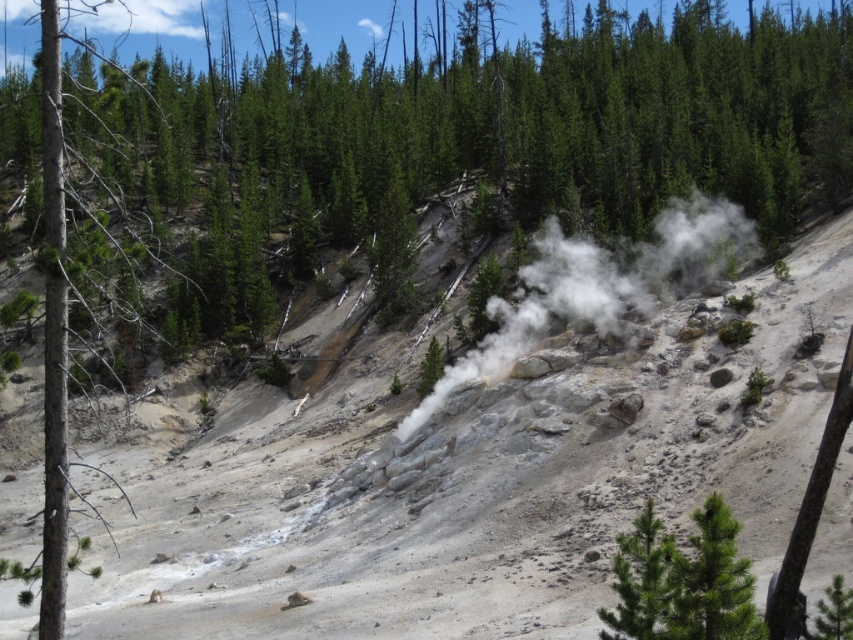
Question: Does gray rocky hillside at center lie behind white steam at center?

Choices:
 (A) yes
 (B) no

Answer: (B)

Question: Is gray rocky hillside at center closer to the viewer compared to white steam at center?

Choices:
 (A) no
 (B) yes

Answer: (B)

Question: Does gray rocky hillside at center have a greater width compared to white steam at center?

Choices:
 (A) no
 (B) yes

Answer: (B)

Question: Which of the following is the closest to the observer?

Choices:
 (A) gray rocky hillside at center
 (B) white steam at center

Answer: (A)

Question: Which of the following is the closest to the observer?

Choices:
 (A) pos(750,240)
 (B) pos(677,403)

Answer: (B)

Question: Which of the following is the farthest from the observer?

Choices:
 (A) (409, 580)
 (B) (575, 316)

Answer: (B)